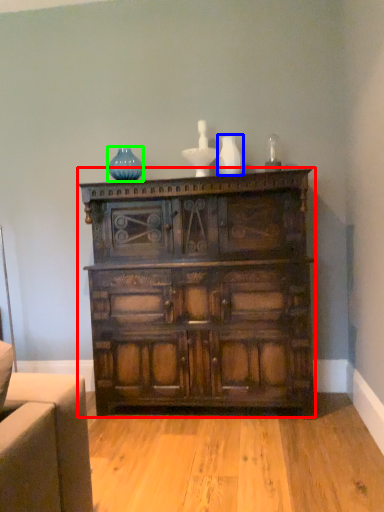
Question: Which object is positioned closest to chest of drawers (highlighted by a red box)? Select from vase (highlighted by a blue box) and glass vase (highlighted by a green box).

Choices:
 (A) vase
 (B) glass vase

Answer: (A)